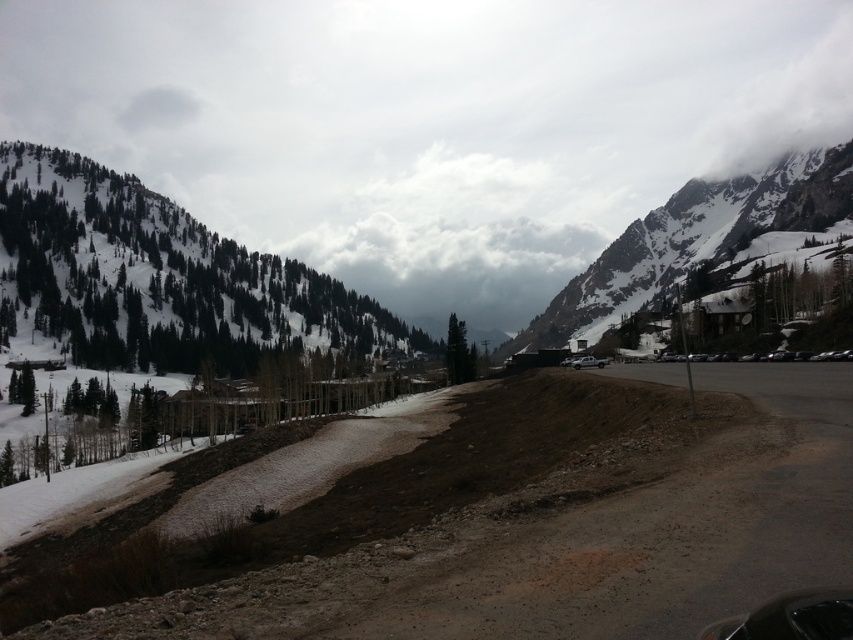
Can you confirm if brown dirt track at center is positioned to the right of snowy granite mountain at upper right?

In fact, brown dirt track at center is to the left of snowy granite mountain at upper right.

Between point (364, 636) and point (799, 202), which one is positioned behind?

Positioned behind is point (799, 202).

Identify the location of brown dirt track at center. (572, 545).

Between snowy evergreen forest at upper left and snowy granite mountain at upper right, which one appears on the right side from the viewer's perspective?

snowy granite mountain at upper right

Does snowy evergreen forest at upper left have a smaller size compared to snowy granite mountain at upper right?

Correct, snowy evergreen forest at upper left occupies less space than snowy granite mountain at upper right.

You are a GUI agent. You are given a task and a screenshot of the screen. Output one action in this format:
    pyautogui.click(x=<x>, y=<y>)
    Task: Click on the snowy evergreen forest at upper left
    
    Given the screenshot: What is the action you would take?
    pyautogui.click(x=160, y=275)

Who is shorter, brown dirt track at center or snowy evergreen forest at upper left?

brown dirt track at center

Who is taller, brown dirt track at center or snowy evergreen forest at upper left?

With more height is snowy evergreen forest at upper left.

Is point (555, 548) behind point (57, 168)?

No.

Locate an element on the screen. This screenshot has width=853, height=640. brown dirt track at center is located at coordinates (572, 545).